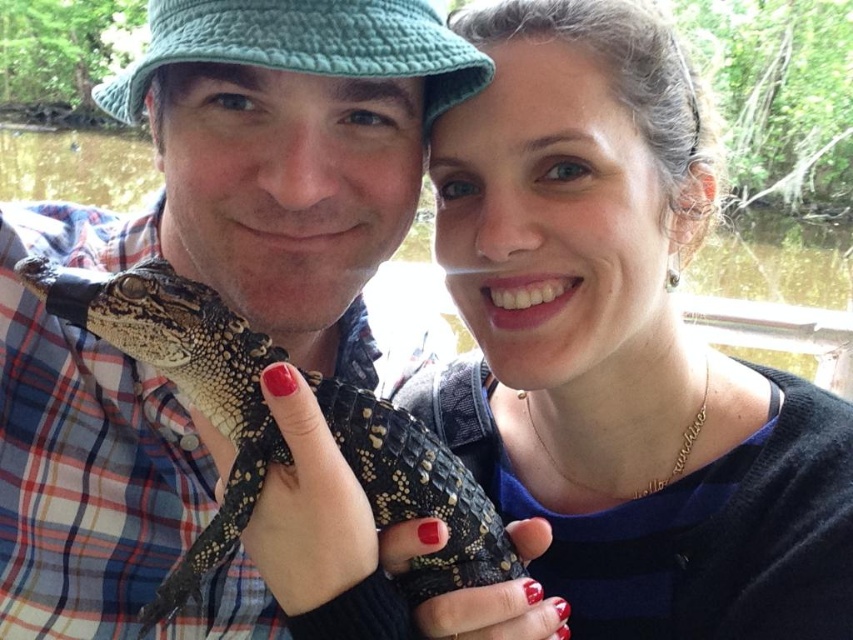
You are a photographer trying to decide which reptile to feature in your nature magazine. You have two reptiles in front of you, the matte black reptile at center and the slick black reptile at center. Based on their height, which one would you choose if you want to highlight a taller reptile?

The slick black reptile at center is taller than the matte black reptile at center, so you should choose the slick black reptile at center to highlight a taller reptile.

You are a photographer trying to focus on the two points in the image. Which point, point (656, 252) or point (61, 506), is closer to you?

Point (656, 252) is closer to the viewer than point (61, 506).